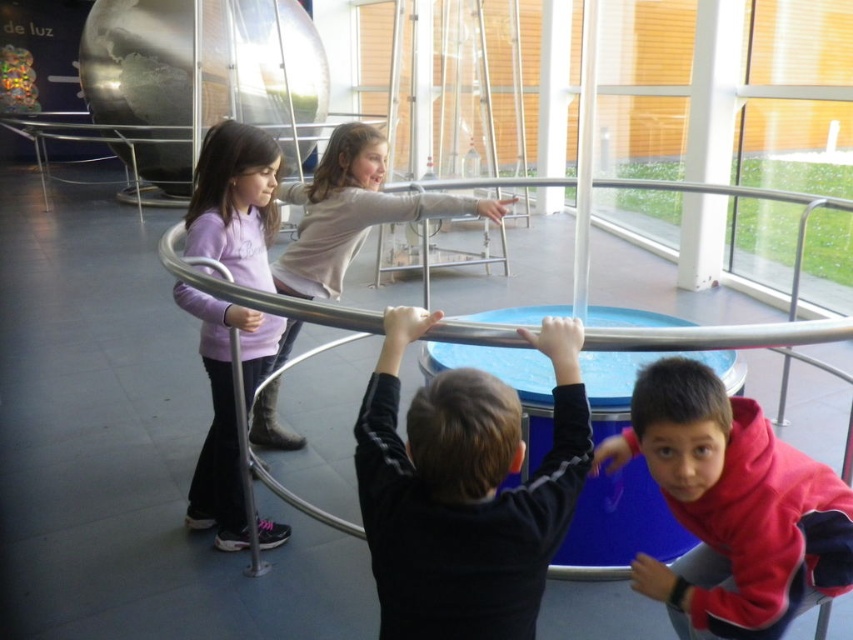
Who is higher up, red fleece jacket at lower right or matte pink sweatshirt at center?

matte pink sweatshirt at center is above.

Measure the distance between red fleece jacket at lower right and matte pink sweatshirt at center.

1.33 meters

In order to click on red fleece jacket at lower right in this screenshot , I will do `click(733, 506)`.

Which is below, silver metallic hula hoop at center or matte gray shirt at center?

matte gray shirt at center

Does silver metallic hula hoop at center have a larger size compared to matte gray shirt at center?

Actually, silver metallic hula hoop at center might be smaller than matte gray shirt at center.

Measure the distance between silver metallic hula hoop at center and camera.

silver metallic hula hoop at center is 8.71 feet away from camera.

Where is `silver metallic hula hoop at center`? The image size is (853, 640). silver metallic hula hoop at center is located at coordinates [723, 336].

Who is taller, black matte shirt at center or silver metallic hula hoop at center?

black matte shirt at center is taller.

From the picture: Can you confirm if black matte shirt at center is positioned to the right of silver metallic hula hoop at center?

Incorrect, black matte shirt at center is not on the right side of silver metallic hula hoop at center.

Is point (525, 552) in front of point (163, 237)?

Yes, it is in front of point (163, 237).

Where is `black matte shirt at center`? black matte shirt at center is located at coordinates (465, 490).